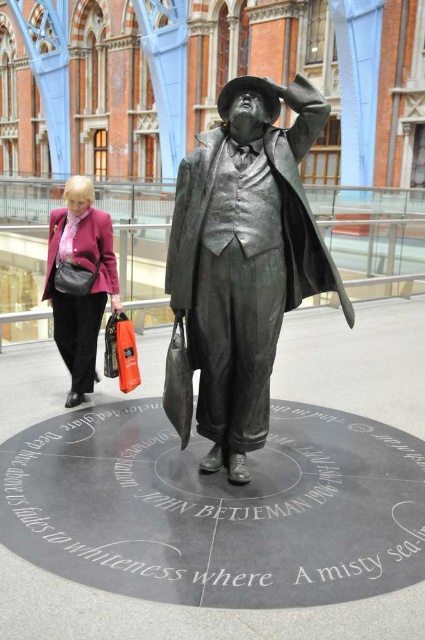
Question: Which of the following is the closest to the observer?

Choices:
 (A) (257, 147)
 (B) (79, 388)

Answer: (A)

Question: Is bronze statue at center to the left of matte pink blazer at left from the viewer's perspective?

Choices:
 (A) no
 (B) yes

Answer: (A)

Question: Where is bronze statue at center located in relation to matte pink blazer at left in the image?

Choices:
 (A) right
 (B) left

Answer: (A)

Question: In this image, where is bronze statue at center located relative to matte pink blazer at left?

Choices:
 (A) right
 (B) left

Answer: (A)

Question: Among these objects, which one is nearest to the camera?

Choices:
 (A) matte pink blazer at left
 (B) bronze statue at center

Answer: (B)

Question: Which point is farther from the camera taking this photo?

Choices:
 (A) (59, 262)
 (B) (234, 180)

Answer: (A)